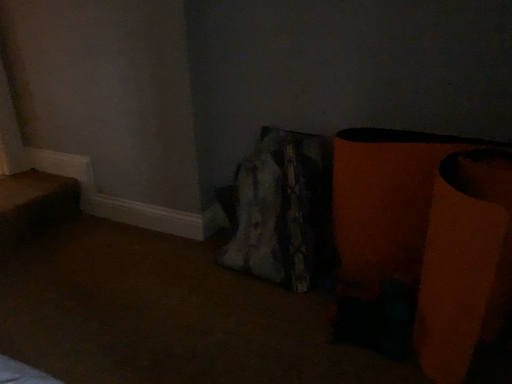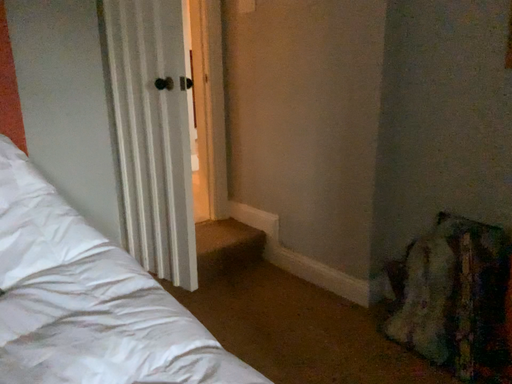
Question: How did the camera likely rotate when shooting the video?

Choices:
 (A) rotated downward
 (B) rotated upward

Answer: (B)